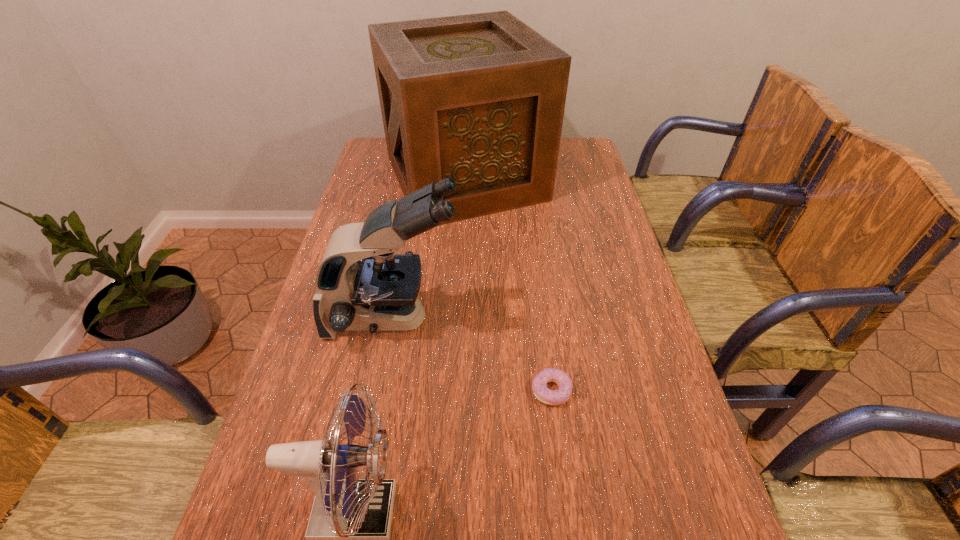
Locate an element on the screen. box is located at coordinates coord(480,98).

You are a GUI agent. You are given a task and a screenshot of the screen. Output one action in this format:
    pyautogui.click(x=<x>, y=<y>)
    Task: Click on the farthest object
    The width and height of the screenshot is (960, 540).
    Given the screenshot: What is the action you would take?
    pyautogui.click(x=480, y=98)

This screenshot has height=540, width=960. I want to click on the third nearest object, so click(380, 292).

The height and width of the screenshot is (540, 960). In order to click on the shortest object in this screenshot , I will do `click(550, 397)`.

The width and height of the screenshot is (960, 540). I want to click on doughnut, so click(550, 397).

I want to click on free region located on the right of the farthest object, so click(x=585, y=178).

Where is `vacant space located 0.190m through the eyepieces of the third nearest object`? Image resolution: width=960 pixels, height=540 pixels. vacant space located 0.190m through the eyepieces of the third nearest object is located at coordinates (538, 318).

Identify the location of free space located 0.280m on the back of the third farthest object. This screenshot has width=960, height=540. (538, 284).

Where is `object present at the far edge`? This screenshot has width=960, height=540. object present at the far edge is located at coordinates (480, 98).

This screenshot has height=540, width=960. I want to click on box that is at the left edge, so click(480, 98).